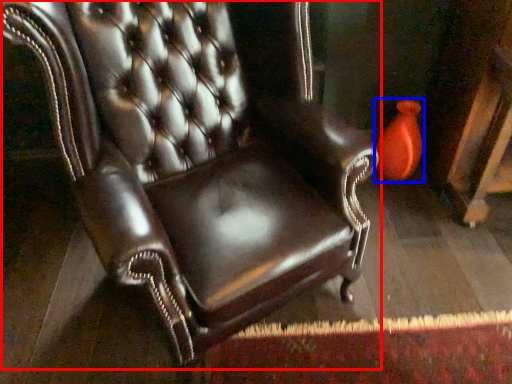
Question: Which point is further to the camera, chair (highlighted by a red box) or vase (highlighted by a blue box)?

Choices:
 (A) chair
 (B) vase

Answer: (B)